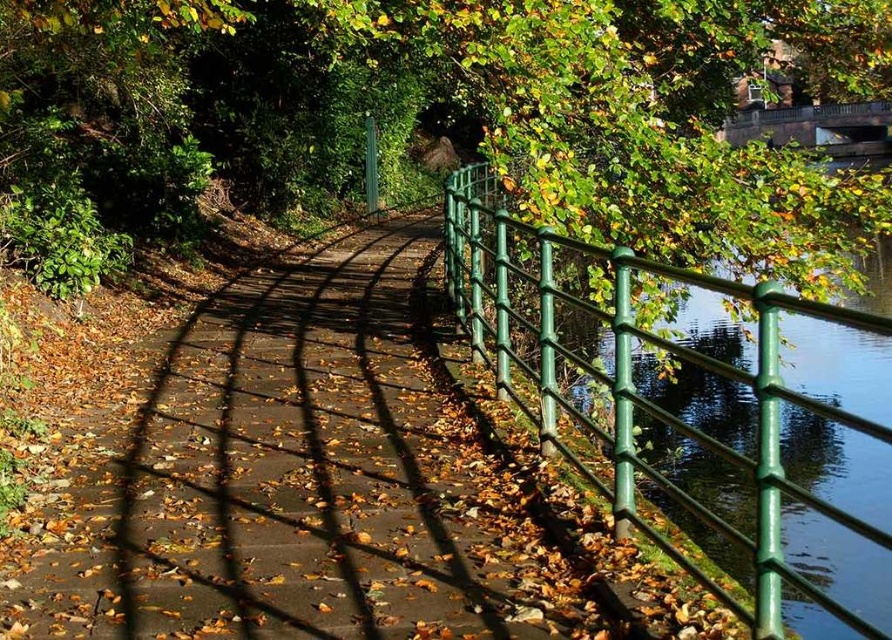
From the picture: Is green metal fence at right smaller than dark gray stone bridge at upper right?

Incorrect, green metal fence at right is not smaller in size than dark gray stone bridge at upper right.

Is green metal fence at right taller than dark gray stone bridge at upper right?

Yes, green metal fence at right is taller than dark gray stone bridge at upper right.

Is point (756, 552) positioned after point (738, 122)?

That is False.

Locate an element on the screen. The image size is (892, 640). green metal fence at right is located at coordinates (634, 387).